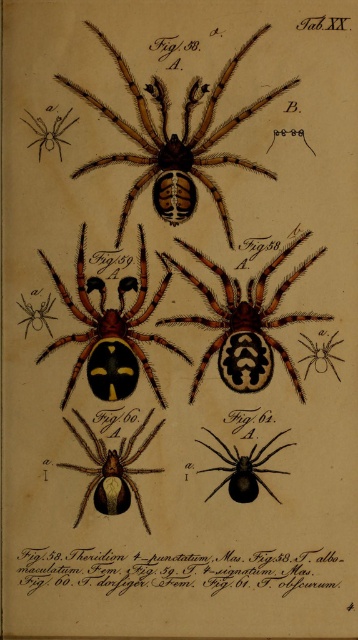
You are an entomologist examining this botanical illustration. You need to locate the black glossy spider at center. According to the coordinates provided, where is the point at position [244,323] in relation to the black glossy spider at center?

The point at position [244,323] corresponds exactly to the location of the black glossy spider at center.

You are an entomologist examining this botanical illustration. You need to compare the height of the black paper text at lower center and the matte black spider at upper left. Which one is taller?

The black paper text at lower center has a lesser height compared to matte black spider at upper left, so the matte black spider at upper left is taller.